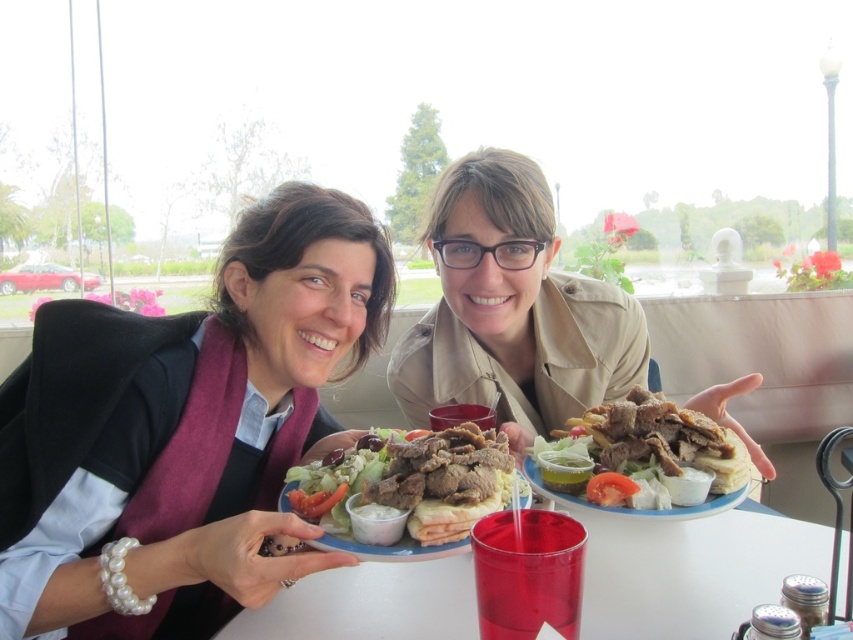
Question: Which object is closer to the camera taking this photo?

Choices:
 (A) golden brown pita bread at center
 (B) transparent plastic cup at center
 (C) shiny brown pita bread at center

Answer: (C)

Question: Considering the real-world distances, which object is closest to the transparent plastic cup at center?

Choices:
 (A) golden brown pita bread at center
 (B) matte black plate at center
 (C) matte black sweater at center
 (D) shiny brown pita bread at center

Answer: (A)

Question: Is matte black plate at center above transparent plastic cup at center?

Choices:
 (A) no
 (B) yes

Answer: (B)

Question: Which object is positioned farthest from the matte black sweater at center?

Choices:
 (A) matte black plate at center
 (B) transparent plastic cup at center
 (C) shiny brown pita bread at center
 (D) golden brown pita bread at center

Answer: (D)

Question: Is matte black sweater at center closer to camera compared to shiny brown pita bread at center?

Choices:
 (A) no
 (B) yes

Answer: (B)

Question: Where is matte black sweater at center located in relation to transparent plastic cup at center in the image?

Choices:
 (A) left
 (B) right

Answer: (A)